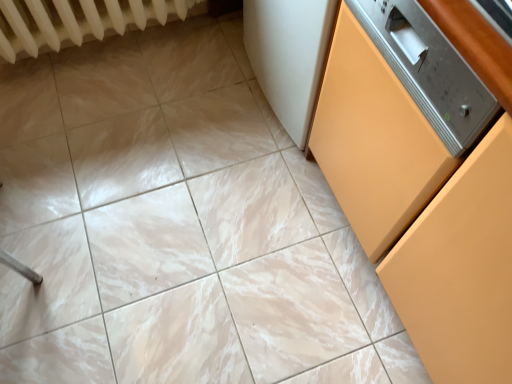
Measure the distance between point (25,30) and camera.

The distance of point (25,30) from camera is 4.81 feet.

Find the location of `white textured radiator at upper left`. white textured radiator at upper left is located at coordinates (78, 21).

This screenshot has width=512, height=384. Describe the element at coordinates (78, 21) in the screenshot. I see `white textured radiator at upper left` at that location.

What do you see at coordinates (421, 210) in the screenshot? I see `matte orange cabinet at right` at bounding box center [421, 210].

Image resolution: width=512 pixels, height=384 pixels. In order to click on matte orange cabinet at right in this screenshot , I will do `click(421, 210)`.

You are a GUI agent. You are given a task and a screenshot of the screen. Output one action in this format:
    pyautogui.click(x=<x>, y=<y>)
    Task: Click on the white textured radiator at upper left
    
    Given the screenshot: What is the action you would take?
    pyautogui.click(x=78, y=21)

Looking at this image, does white textured radiator at upper left appear on the right side of matte orange cabinet at right?

No.

Is the position of white textured radiator at upper left less distant than that of matte orange cabinet at right?

No, white textured radiator at upper left is further to the viewer.

Does point (34, 52) come closer to viewer compared to point (462, 209)?

No, (34, 52) is further to viewer.

From the image's perspective, is white textured radiator at upper left located above matte orange cabinet at right?

Yes.

From a real-world perspective, does white textured radiator at upper left sit lower than matte orange cabinet at right?

Yes, from a real-world perspective, white textured radiator at upper left is beneath matte orange cabinet at right.

Considering the sizes of objects white textured radiator at upper left and matte orange cabinet at right in the image provided, who is wider, white textured radiator at upper left or matte orange cabinet at right?

Wider between the two is matte orange cabinet at right.

Between white textured radiator at upper left and matte orange cabinet at right, which one has less height?

white textured radiator at upper left is shorter.

Does white textured radiator at upper left have a larger size compared to matte orange cabinet at right?

Incorrect, white textured radiator at upper left is not larger than matte orange cabinet at right.

Would you say white textured radiator at upper left is outside matte orange cabinet at right?

Yes, white textured radiator at upper left is located beyond the bounds of matte orange cabinet at right.

Can you see white textured radiator at upper left touching matte orange cabinet at right?

No.

Is matte orange cabinet at right at the back of white textured radiator at upper left?

No, matte orange cabinet at right is not at the back of white textured radiator at upper left.

Can you tell me how much white textured radiator at upper left and matte orange cabinet at right differ in facing direction?

They differ by 89.9 degrees in their facing directions.

You are a GUI agent. You are given a task and a screenshot of the screen. Output one action in this format:
    pyautogui.click(x=<x>, y=<y>)
    Task: Click on the radiator on the left of matte orange cabinet at right
    
    Given the screenshot: What is the action you would take?
    pyautogui.click(x=78, y=21)

Is matte orange cabinet at right to the right of white textured radiator at upper left from the viewer's perspective?

Yes.

Is matte orange cabinet at right further to camera compared to white textured radiator at upper left?

No.

Looking at this image, which point is more forward, (468, 4) or (99, 7)?

The point (468, 4) is closer.

From the image's perspective, is matte orange cabinet at right beneath white textured radiator at upper left?

Yes, from the image's perspective, matte orange cabinet at right is beneath white textured radiator at upper left.

From a real-world perspective, is matte orange cabinet at right positioned above or below white textured radiator at upper left?

In terms of real-world spatial position, matte orange cabinet at right is above white textured radiator at upper left.

Does matte orange cabinet at right have a lesser width compared to white textured radiator at upper left?

In fact, matte orange cabinet at right might be wider than white textured radiator at upper left.

Which of these two, matte orange cabinet at right or white textured radiator at upper left, stands shorter?

white textured radiator at upper left is shorter.

Considering the sizes of matte orange cabinet at right and white textured radiator at upper left in the image, is matte orange cabinet at right bigger or smaller than white textured radiator at upper left?

Considering their sizes, matte orange cabinet at right takes up more space than white textured radiator at upper left.

Is white textured radiator at upper left surrounded by matte orange cabinet at right?

No.

Can you see matte orange cabinet at right touching white textured radiator at upper left?

No.

Is matte orange cabinet at right facing towards white textured radiator at upper left?

No, matte orange cabinet at right is not aimed at white textured radiator at upper left.

From the picture: How far apart are matte orange cabinet at right and white textured radiator at upper left?

1.18 meters.

Locate an element on the screen. radiator that is on the left side of matte orange cabinet at right is located at coordinates (78, 21).

In order to click on radiator behind the matte orange cabinet at right in this screenshot , I will do `click(78, 21)`.

Find the location of a particular element. cabinetry above the white textured radiator at upper left (from a real-world perspective) is located at coordinates (421, 210).